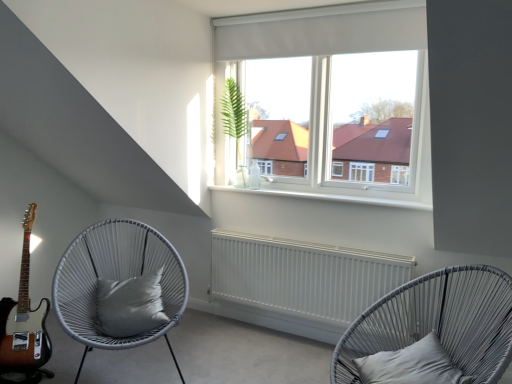
Question: In terms of height, does green leafy plant at center look taller or shorter compared to white matte curtain at upper center?

Choices:
 (A) tall
 (B) short

Answer: (A)

Question: Considering their positions, is green leafy plant at center located in front of or behind white matte curtain at upper center?

Choices:
 (A) behind
 (B) front

Answer: (A)

Question: Which of these objects is positioned closest to the gray satin pillow at lower right, the second pillow from the back?

Choices:
 (A) white matte radiator at center
 (B) white woven chair with cushion at left, the first chair when ordered from left to right
 (C) green leafy plant at center
 (D) white matte curtain at upper center
 (E) sunburst wood guitar at lower left

Answer: (A)

Question: Based on their relative distances, which object is farther from the silky gray pillow at center-left, positioned as the first pillow in back-to-front order?

Choices:
 (A) matte grey wicker chair at lower right, which is the 1th chair in right-to-left order
 (B) sunburst wood guitar at lower left
 (C) white woven chair with cushion at left, the first chair when ordered from left to right
 (D) white matte curtain at upper center
 (E) green leafy plant at center

Answer: (D)